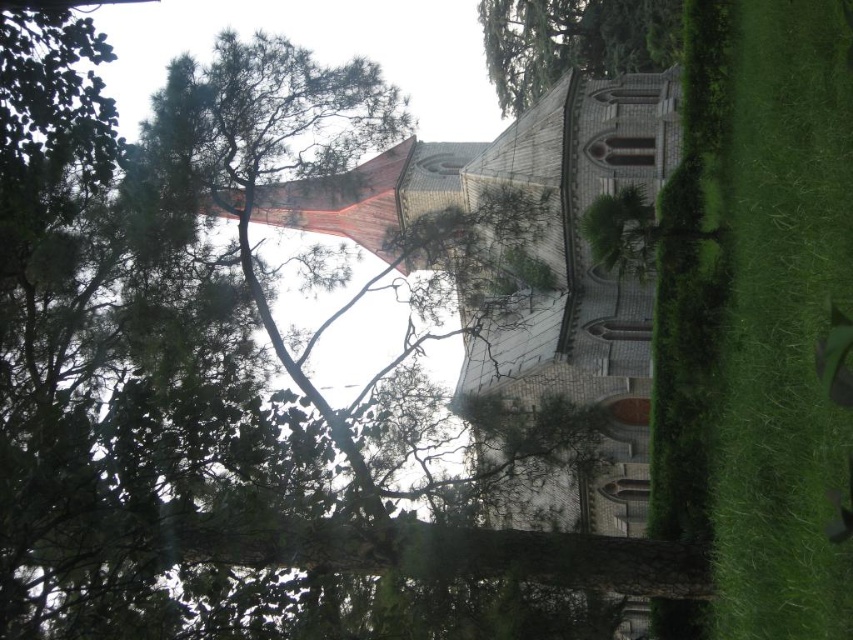
Can you confirm if green grass at lower right is positioned below green textured tree at upper center?

Yes, green grass at lower right is below green textured tree at upper center.

Is the position of green grass at lower right more distant than that of green textured tree at upper center?

No.

Image resolution: width=853 pixels, height=640 pixels. What are the coordinates of `green grass at lower right` in the screenshot? It's located at (756, 321).